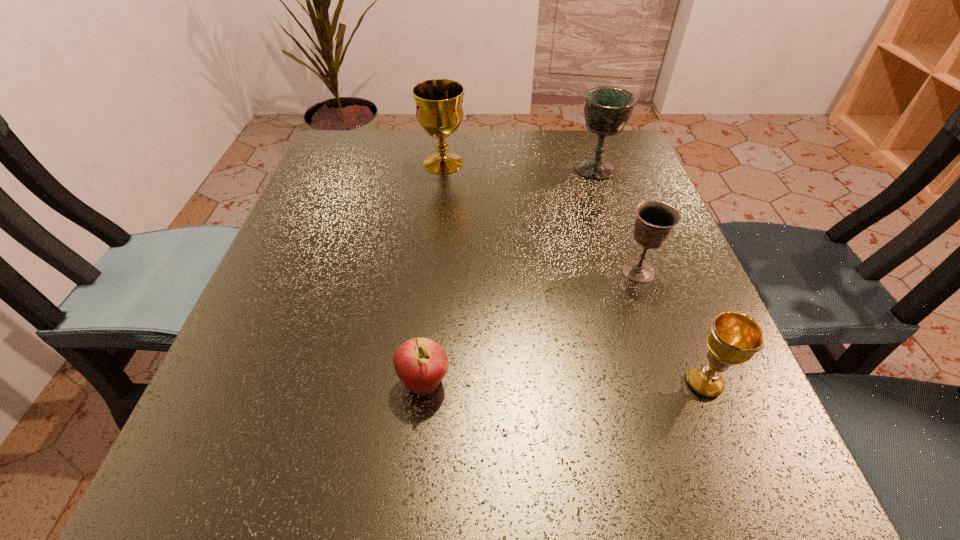
Identify the location of vacant space that's between the leftmost chalice and the nearest chalice. The height and width of the screenshot is (540, 960). (573, 273).

I want to click on object that is the closest to the third nearest object, so click(734, 338).

Locate which object ranks second in proximity to the apple. Please provide its 2D coordinates. Your answer should be formatted as a tuple, i.e. [(x, y)], where the tuple contains the x and y coordinates of a point satisfying the conditions above.

[(734, 338)]

Identify which chalice is located as the second nearest to the third farthest chalice. Please provide its 2D coordinates. Your answer should be formatted as a tuple, i.e. [(x, y)], where the tuple contains the x and y coordinates of a point satisfying the conditions above.

[(607, 110)]

Choose which chalice is the second nearest neighbor to the leftmost chalice. Please provide its 2D coordinates. Your answer should be formatted as a tuple, i.e. [(x, y)], where the tuple contains the x and y coordinates of a point satisfying the conditions above.

[(655, 221)]